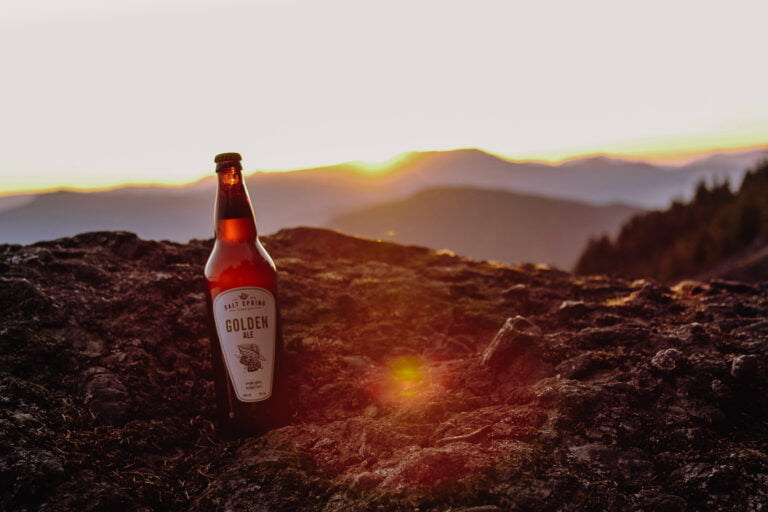
Image resolution: width=768 pixels, height=512 pixels. What are the coordinates of `bottle` in the screenshot? It's located at (243, 275).